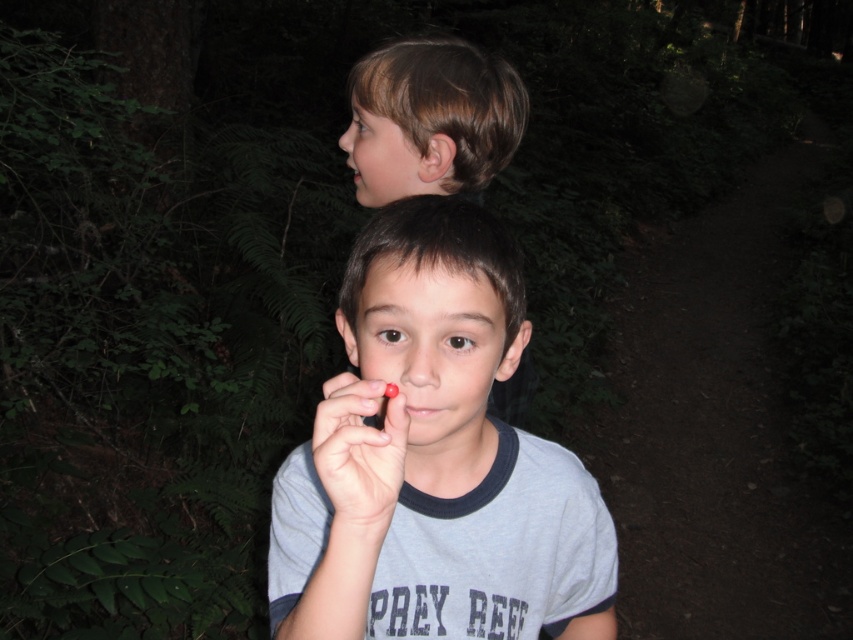
Question: Where is brown hair at upper center located in relation to smooth skin at center in the image?

Choices:
 (A) above
 (B) below

Answer: (A)

Question: Estimate the real-world distances between objects in this image. Which object is farther from the brown hair at upper center?

Choices:
 (A) smooth skin at center
 (B) gray cotton shirt at center

Answer: (A)

Question: Is smooth skin face at center below smooth brown hair at upper center?

Choices:
 (A) yes
 (B) no

Answer: (A)

Question: Which object is farther from the camera taking this photo?

Choices:
 (A) smooth skin face at center
 (B) smooth skin at center
 (C) smooth brown hair at upper center
 (D) brown hair at upper center

Answer: (D)

Question: Among these points, which one is nearest to the camera?

Choices:
 (A) (514, 344)
 (B) (390, 406)
 (C) (369, 444)

Answer: (B)

Question: Does brown hair at upper center appear over smooth skin face at center?

Choices:
 (A) yes
 (B) no

Answer: (A)